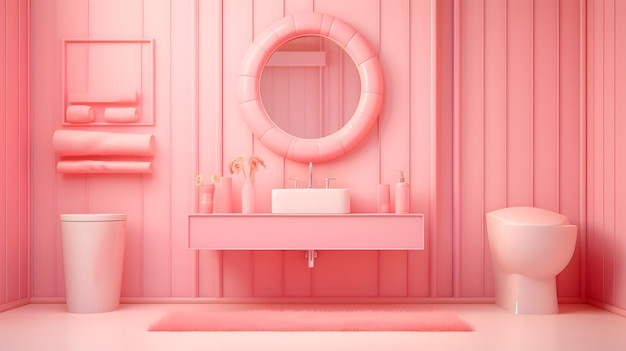
Find the location of a particular element. The width and height of the screenshot is (626, 351). toilet is located at coordinates (525, 244).